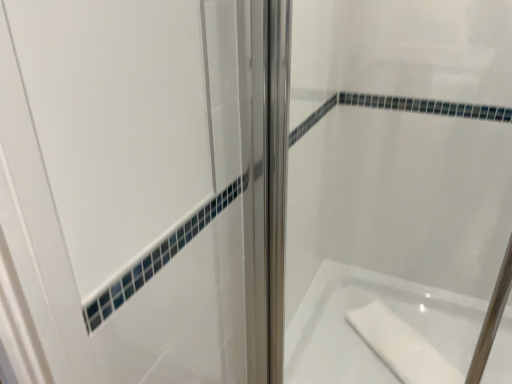
Question: In the image, is white glossy bathtub at lower right positioned in front of or behind clear glass shower door at center?

Choices:
 (A) behind
 (B) front

Answer: (A)

Question: From the image's perspective, is white glossy bathtub at lower right located above or below clear glass shower door at center?

Choices:
 (A) above
 (B) below

Answer: (B)

Question: Which object is positioned closest to the white glossy bathtub at lower right?

Choices:
 (A) clear glass shower door at center
 (B) white matte soap at lower right

Answer: (B)

Question: Which object is the farthest from the white glossy bathtub at lower right?

Choices:
 (A) clear glass shower door at center
 (B) white matte soap at lower right

Answer: (A)